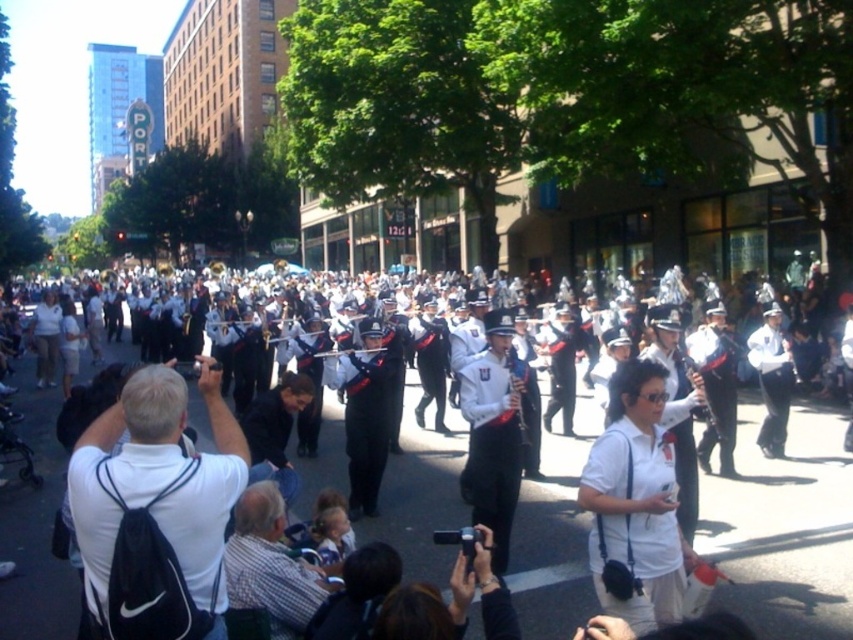
You are a photographer standing at the origin point of the image coordinate system. You want to take a photo of the white glossy uniform at center. What are the coordinates where you should aim your camera?

The coordinates where you should aim your camera are at point (492, 433).

You are a photographer standing at the origin point of the coordinate system in the image. You want to capture a photo of the white glossy uniform at center. What are the coordinates where you should aim your camera?

The coordinates where you should aim your camera are at point [492,433], as that is the position of the white glossy uniform at center.

You are a photographer trying to capture the entire marching band in your shot. You notice the plaid shirt at lower center and the shiny silver flute at center. Which object takes up more space in the image?

The shiny silver flute at center takes up more space in the image than the plaid shirt at lower center because the plaid shirt at lower center occupies less space than shiny silver flute at center.